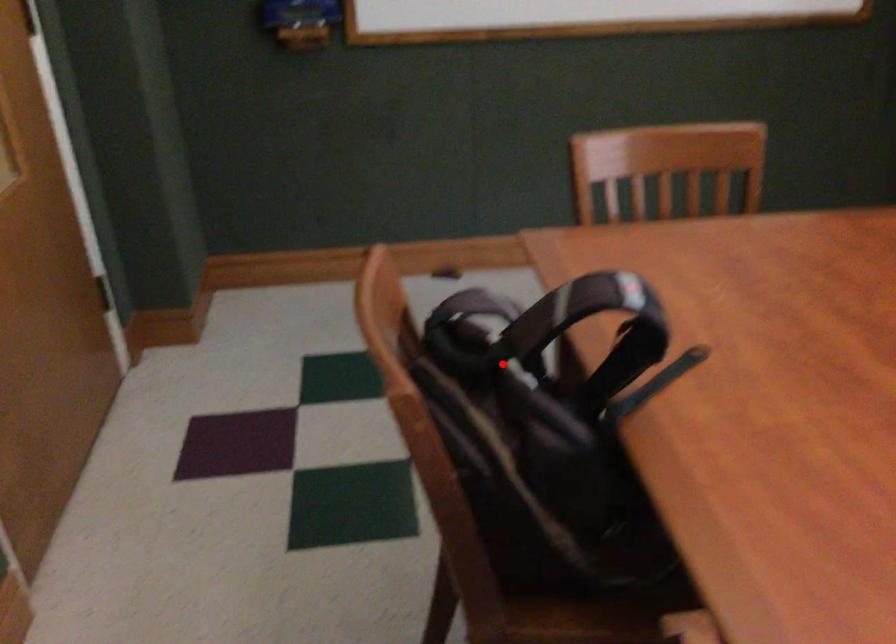
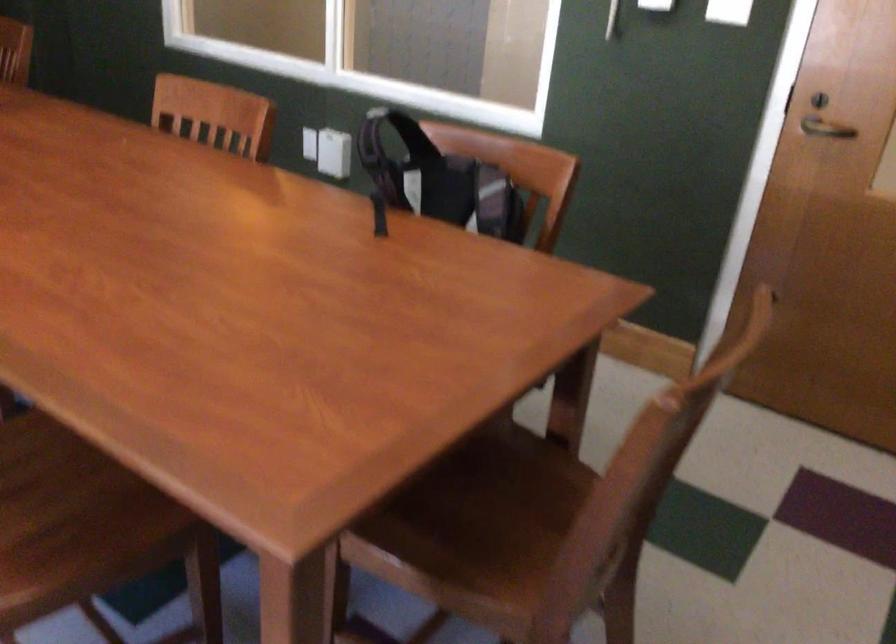
The point at the highlighted location is marked in the first image. Where is the corresponding point in the second image?

(438, 180)